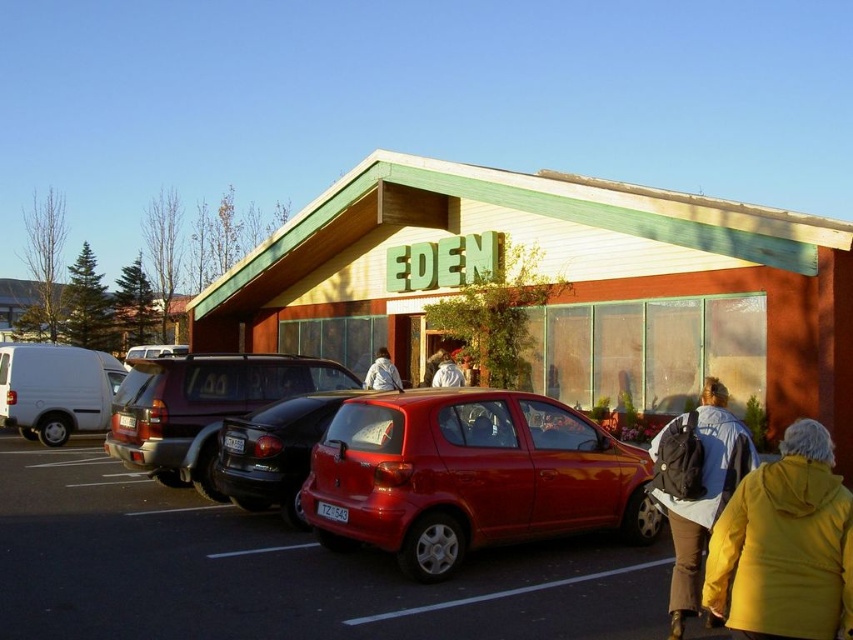
Question: Which of the following is the farthest from the observer?

Choices:
 (A) (318, 384)
 (B) (840, 611)
 (C) (360, 426)

Answer: (A)

Question: Estimate the real-world distances between objects in this image. Which object is closer to the white fabric jacket at center?

Choices:
 (A) white matte van at left
 (B) matte silver van at center
 (C) matte black backpack at lower right

Answer: (A)

Question: Does matte silver van at center have a smaller size compared to black rubber line at lower center?

Choices:
 (A) yes
 (B) no

Answer: (B)

Question: Is wooden siding building at center to the left of white fabric jacket at center from the viewer's perspective?

Choices:
 (A) no
 (B) yes

Answer: (A)

Question: Can you confirm if matte black backpack at lower right is positioned to the left of black rubber line at lower center?

Choices:
 (A) yes
 (B) no

Answer: (B)

Question: Which point is farther to the camera?

Choices:
 (A) black rubber line at lower center
 (B) white fabric jacket at center
 (C) matte black suv at center

Answer: (B)